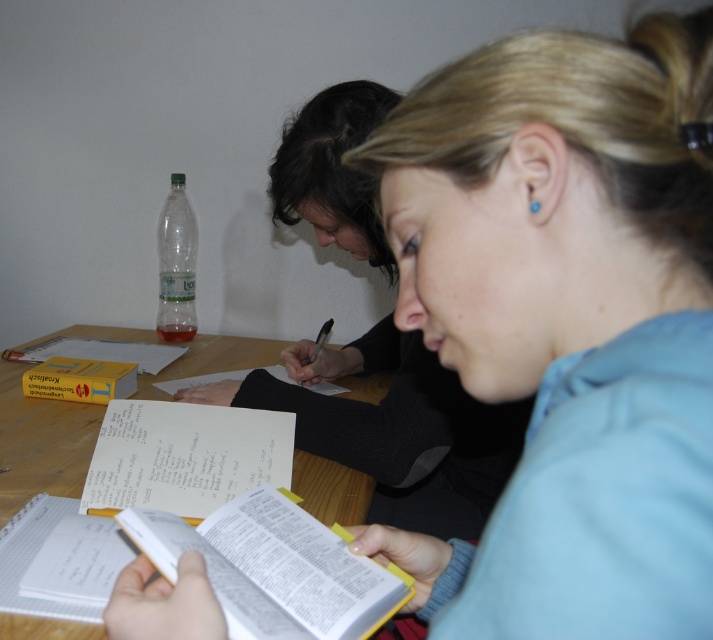
Question: Estimate the real-world distances between objects in this image. Which object is farther from the wooden table at center?

Choices:
 (A) white paper book at center
 (B) transparent plastic bottle at upper left
 (C) smooth black sweater at center
 (D) white paper notebook at center

Answer: (C)

Question: Which point is closer to the camera?

Choices:
 (A) white paper notebook at center
 (B) wooden table at center
 (C) transparent plastic bottle at upper left
 (D) smooth black sweater at center

Answer: (B)

Question: Can you confirm if smooth black sweater at center is positioned below transparent plastic bottle at upper left?

Choices:
 (A) yes
 (B) no

Answer: (A)

Question: Which of the following is the closest to the observer?

Choices:
 (A) white paper notebook at center
 (B) white paper book at center
 (C) smooth black sweater at center

Answer: (B)

Question: From the image, what is the correct spatial relationship of white paper book at center in relation to white paper notebook at center?

Choices:
 (A) above
 (B) below

Answer: (B)

Question: Is wooden table at center smaller than transparent plastic bottle at upper left?

Choices:
 (A) no
 (B) yes

Answer: (A)